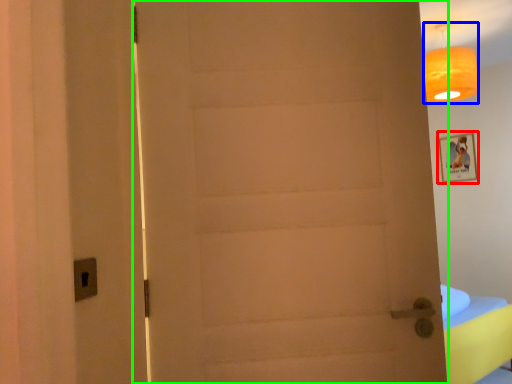
Question: Estimate the real-world distances between objects in this image. Which object is closer to picture frame (highlighted by a red box), lamp (highlighted by a blue box) or door (highlighted by a green box)?

Choices:
 (A) lamp
 (B) door

Answer: (A)